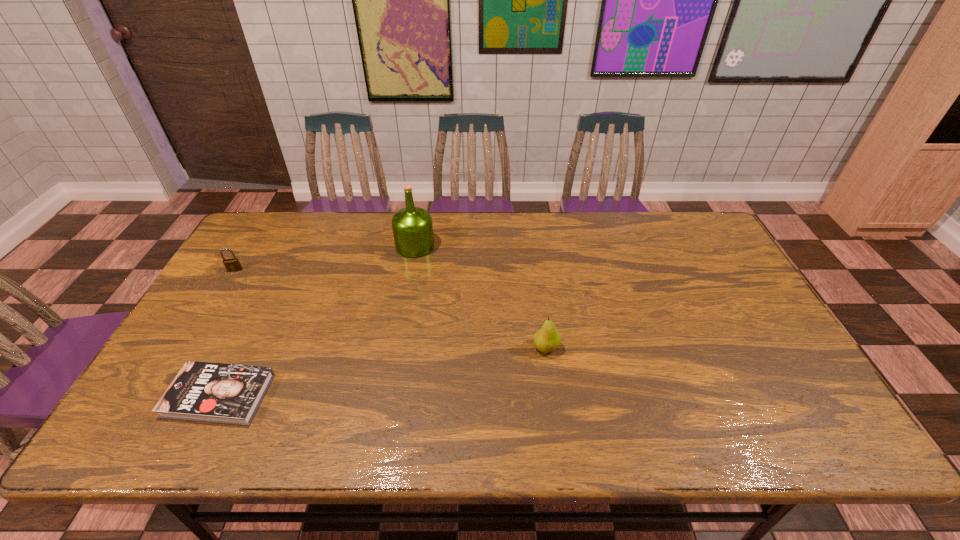
You are a GUI agent. You are given a task and a screenshot of the screen. Output one action in this format:
    pyautogui.click(x=<x>, y=<y>)
    Task: Click on the vacant region between the second object from left to right and the third tallest object
    This screenshot has height=540, width=960.
    Given the screenshot: What is the action you would take?
    pyautogui.click(x=228, y=333)

Where is `free spot between the nearest object and the leftmost object`? Image resolution: width=960 pixels, height=540 pixels. free spot between the nearest object and the leftmost object is located at coordinates [228, 333].

Where is `free spot between the pear and the leftmost object`? free spot between the pear and the leftmost object is located at coordinates (391, 309).

The width and height of the screenshot is (960, 540). In order to click on unoccupied position between the book and the second farthest object in this screenshot , I will do `click(228, 333)`.

Identify the location of object that is the third closest one to the third nearest object. (547, 339).

Locate an element on the screen. The width and height of the screenshot is (960, 540). object that is the third closest to the second farthest object is located at coordinates (547, 339).

Identify the location of free region that satisfies the following two spatial constraints: 1. on the front side of the third farthest object; 2. on the right side of the leftmost object. (188, 348).

Image resolution: width=960 pixels, height=540 pixels. I want to click on free region that satisfies the following two spatial constraints: 1. on the front side of the leftmost object; 2. on the left side of the pear, so click(188, 348).

This screenshot has height=540, width=960. Find the location of `free location that satisfies the following two spatial constraints: 1. on the front side of the farthest object; 2. on the left side of the second tallest object`. free location that satisfies the following two spatial constraints: 1. on the front side of the farthest object; 2. on the left side of the second tallest object is located at coordinates tap(397, 348).